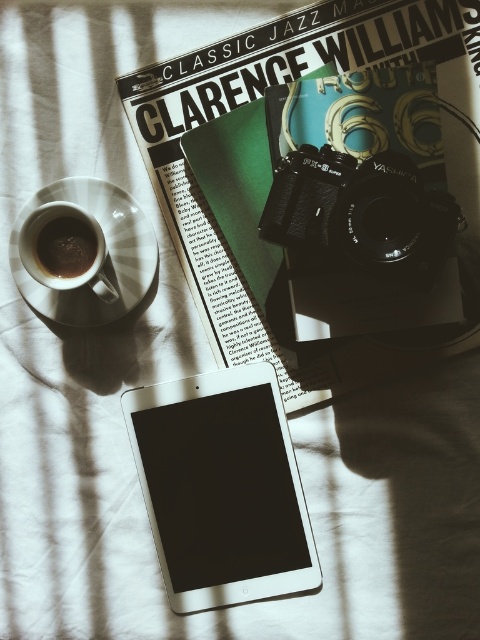
Does silver metallic tablet at center appear on the left side of dark matte coffee cup at upper left?

No, silver metallic tablet at center is not to the left of dark matte coffee cup at upper left.

At what (x,y) coordinates should I click in order to perform the action: click on silver metallic tablet at center. Please return your answer as a coordinate pair (x, y). This screenshot has width=480, height=640. Looking at the image, I should click on (222, 486).

Who is more forward, (x=252, y=570) or (x=64, y=225)?

Positioned in front is point (x=64, y=225).

Locate an element on the screen. silver metallic tablet at center is located at coordinates (222, 486).

Find the location of a particular element. The width and height of the screenshot is (480, 640). matte paper magazine at upper center is located at coordinates (252, 99).

Does point (340, 52) come farther from viewer compared to point (64, 236)?

Yes, point (340, 52) is farther from viewer.

Locate an element on the screen. Image resolution: width=480 pixels, height=640 pixels. matte paper magazine at upper center is located at coordinates (252, 99).

Is the position of silver metallic tablet at center less distant than that of black matte camera at center?

No, it is not.

The image size is (480, 640). I want to click on silver metallic tablet at center, so click(x=222, y=486).